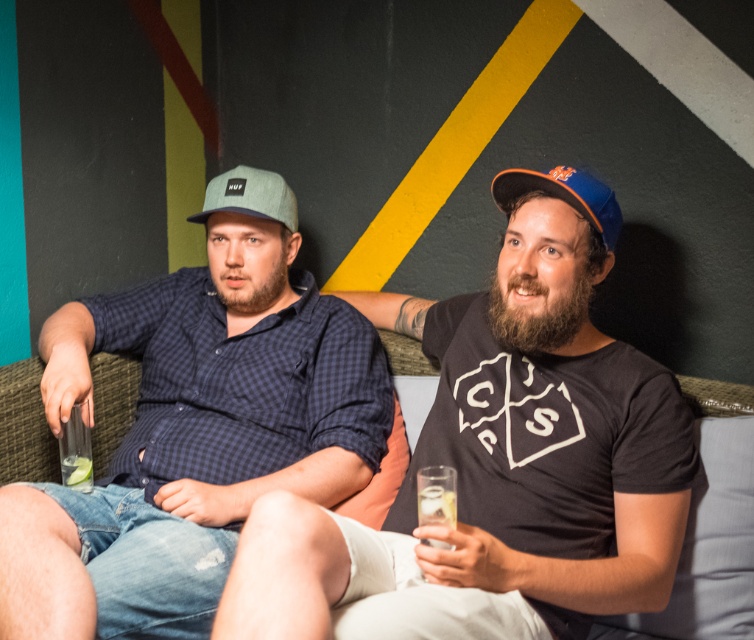
Is green fabric couch at center to the left of blue fabric baseball cap at right from the viewer's perspective?

Yes, green fabric couch at center is to the left of blue fabric baseball cap at right.

The image size is (754, 640). What do you see at coordinates (23, 426) in the screenshot? I see `green fabric couch at center` at bounding box center [23, 426].

Between point (46, 428) and point (553, 184), which one is positioned behind?

The point (46, 428) is behind.

At what (x,y) coordinates should I click in order to perform the action: click on green fabric couch at center. Please return your answer as a coordinate pair (x, y). The height and width of the screenshot is (640, 754). Looking at the image, I should click on (23, 426).

Can you confirm if matte blue cap at center is positioned to the right of clear glass at lower left?

Yes, matte blue cap at center is to the right of clear glass at lower left.

Is matte blue cap at center smaller than clear glass at lower left?

No.

Describe the element at coordinates (541, 433) in the screenshot. I see `matte blue cap at center` at that location.

Find the location of a particular element. matte blue cap at center is located at coordinates (541, 433).

Is clear glass at right below green matte lime at lower left?

Correct, clear glass at right is located below green matte lime at lower left.

Who is positioned more to the left, clear glass at right or green matte lime at lower left?

Positioned to the left is green matte lime at lower left.

Who is more distant from viewer, (x=428, y=540) or (x=90, y=481)?

Positioned behind is point (x=90, y=481).

Image resolution: width=754 pixels, height=640 pixels. Identify the location of clear glass at right. pyautogui.click(x=437, y=506).